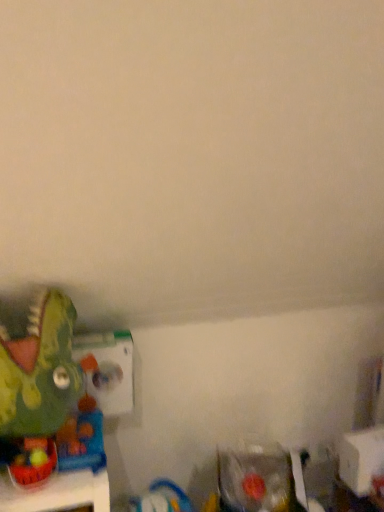
Question: Based on their sizes in the image, would you say green matte dinosaur at left, which appears as the third toy when ordered from the bottom, is bigger or smaller than rubberized green dinosaur at lower left, which is the 2th toy in top-to-bottom order?

Choices:
 (A) big
 (B) small

Answer: (A)

Question: In terms of height, does green matte dinosaur at left, which appears as the third toy when ordered from the bottom, look taller or shorter compared to rubberized green dinosaur at lower left, the first toy in the left-to-right sequence?

Choices:
 (A) short
 (B) tall

Answer: (B)

Question: Which object is positioned closest to the clear plastic toy at lower right, which is the first toy in bottom-to-top order?

Choices:
 (A) rubberized green dinosaur at lower left, the first toy in the left-to-right sequence
 (B) green matte dinosaur at left, positioned as the 2th toy in right-to-left order

Answer: (B)

Question: Estimate the real-world distances between objects in this image. Which object is closer to the rubberized green dinosaur at lower left, which is the 2th toy in top-to-bottom order?

Choices:
 (A) green matte dinosaur at left, which appears as the third toy when ordered from the bottom
 (B) clear plastic toy at lower right, which is the first toy in bottom-to-top order

Answer: (A)